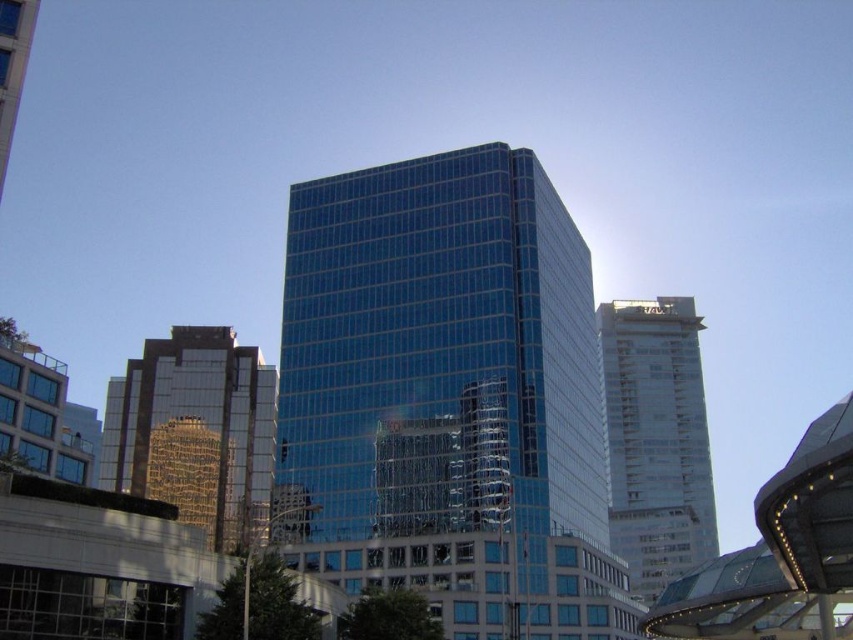
Which is in front, point (370, 525) or point (642, 596)?

Point (370, 525)

Between glassy blue skyscraper at center and white glass tower at right, which one is positioned higher?

glassy blue skyscraper at center is higher up.

Who is more distant from viewer, (451, 531) or (668, 531)?

The point (668, 531) is more distant.

I want to click on glassy blue skyscraper at center, so click(x=448, y=396).

Is reflective glass building at left thinner than white glass tower at right?

Indeed, reflective glass building at left has a lesser width compared to white glass tower at right.

Does reflective glass building at left have a greater width compared to white glass tower at right?

Incorrect, reflective glass building at left's width does not surpass white glass tower at right's.

Does point (218, 440) come in front of point (666, 497)?

That is True.

The width and height of the screenshot is (853, 640). I want to click on reflective glass building at left, so click(x=195, y=429).

Is glassy blue skyscraper at center to the left of reflective glass building at left from the viewer's perspective?

In fact, glassy blue skyscraper at center is to the right of reflective glass building at left.

Who is shorter, glassy blue skyscraper at center or reflective glass building at left?

reflective glass building at left is shorter.

What do you see at coordinates (448, 396) in the screenshot? The image size is (853, 640). I see `glassy blue skyscraper at center` at bounding box center [448, 396].

Where is `glassy blue skyscraper at center`? glassy blue skyscraper at center is located at coordinates (448, 396).